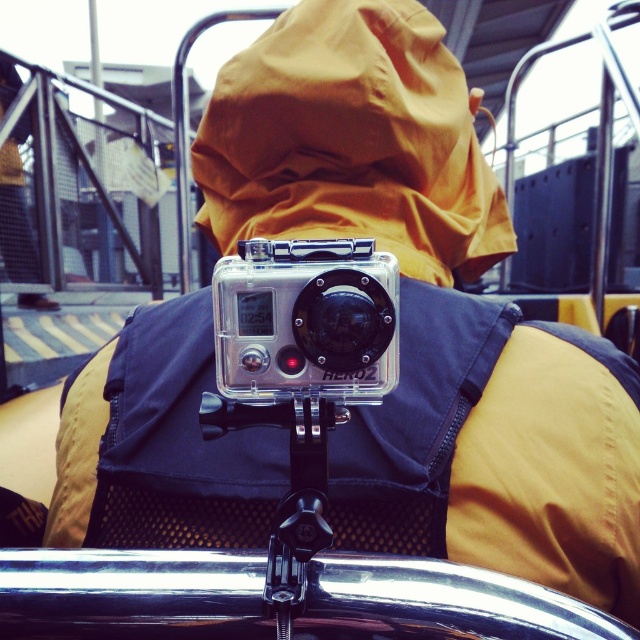
Question: Which point is closer to the camera?

Choices:
 (A) (369, 342)
 (B) (314, 465)

Answer: (A)

Question: Can you confirm if clear plastic camera at center is smaller than black plastic tripod at center?

Choices:
 (A) no
 (B) yes

Answer: (A)

Question: Which object appears closest to the camera in this image?

Choices:
 (A) clear plastic camera at center
 (B) black plastic tripod at center

Answer: (A)

Question: Can you confirm if clear plastic camera at center is positioned below black plastic tripod at center?

Choices:
 (A) yes
 (B) no

Answer: (B)

Question: From the image, what is the correct spatial relationship of clear plastic camera at center in relation to black plastic tripod at center?

Choices:
 (A) left
 (B) right

Answer: (A)